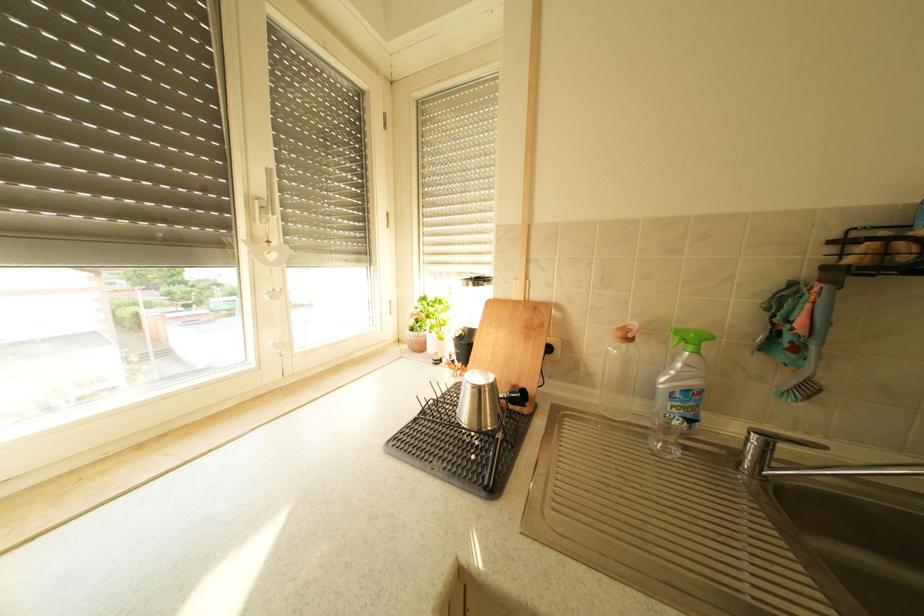
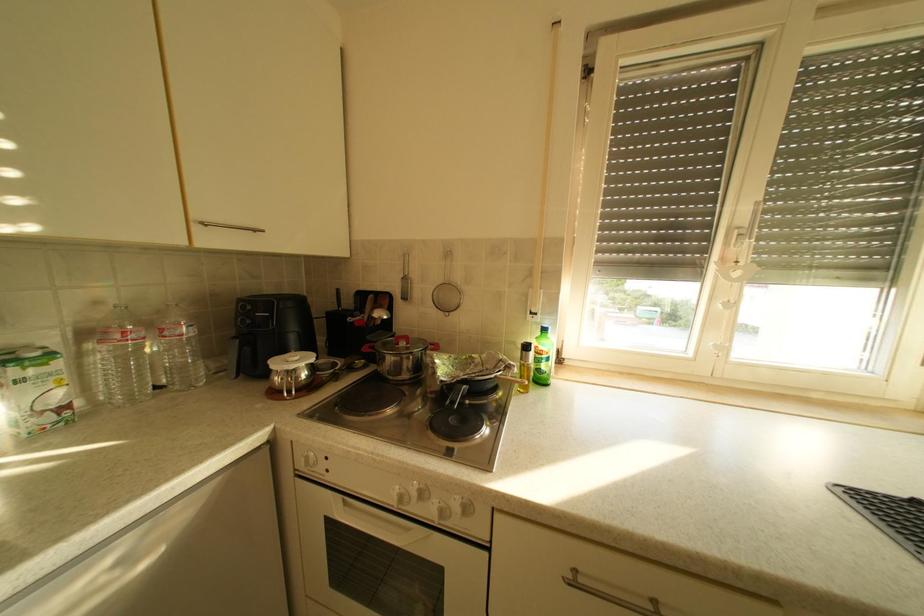
Question: How did the camera likely rotate?

Choices:
 (A) Left
 (B) Right
 (C) Up
 (D) Down

Answer: (A)